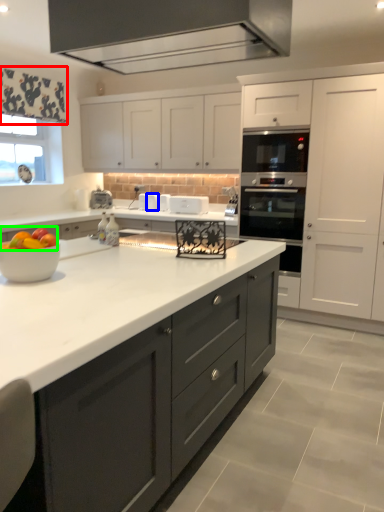
Question: Which object is the closest to the curtain (highlighted by a red box)? Choose among these: appliance (highlighted by a blue box) or fruit (highlighted by a green box).

Choices:
 (A) appliance
 (B) fruit

Answer: (A)